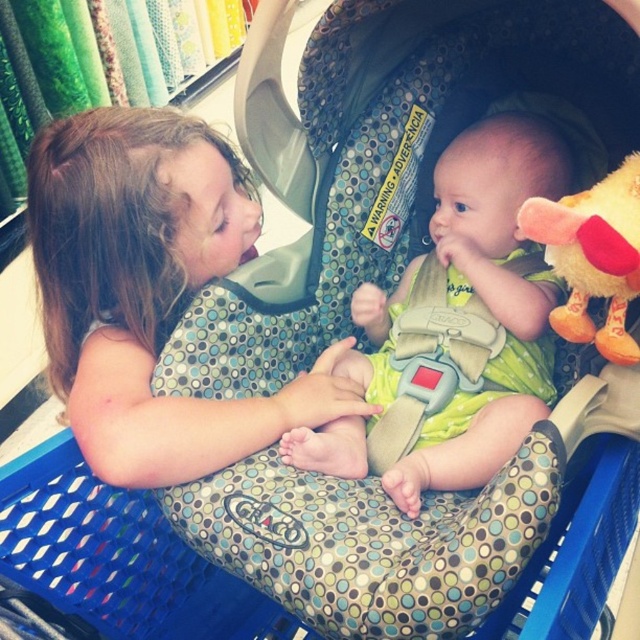
Question: Estimate the real-world distances between objects in this image. Which object is closer to the green polka dot baby car seat at center?

Choices:
 (A) fluffy yellow plush toy at right
 (B) matte green fabric at center

Answer: (A)

Question: Can you confirm if green polka dot baby car seat at center is positioned below fluffy yellow plush toy at right?

Choices:
 (A) no
 (B) yes

Answer: (B)

Question: Which is farther from the green polka dot baby car seat at center?

Choices:
 (A) fluffy yellow plush toy at right
 (B) matte green fabric at center

Answer: (B)

Question: Is matte green fabric at center above fluffy yellow plush toy at right?

Choices:
 (A) no
 (B) yes

Answer: (A)

Question: Considering the real-world distances, which object is farthest from the matte green fabric at center?

Choices:
 (A) fluffy yellow plush toy at right
 (B) green polka dot baby car seat at center

Answer: (A)

Question: Does matte green fabric at center appear on the left side of green polka dot baby car seat at center?

Choices:
 (A) no
 (B) yes

Answer: (B)